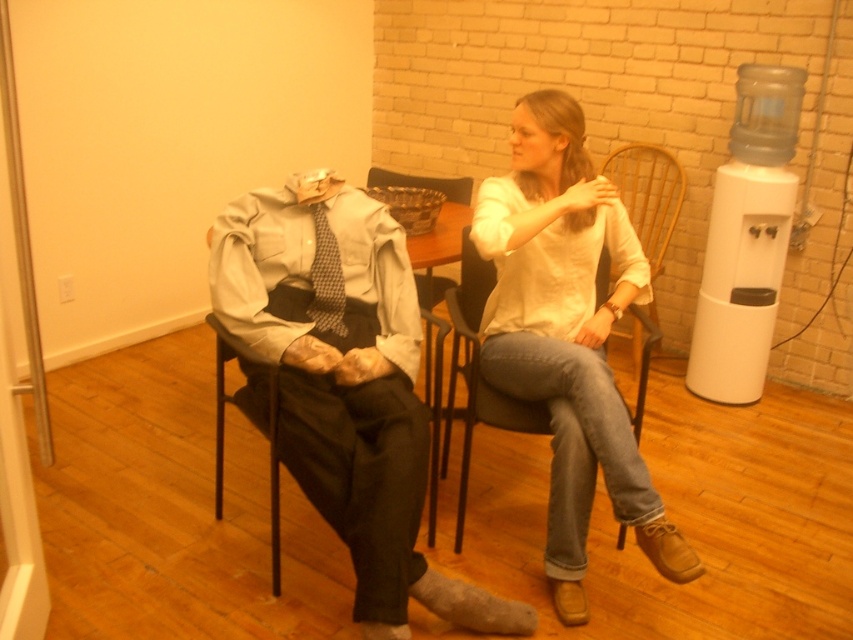
Who is positioned more to the right, matte gray suit at center or white cotton shirt at center?

white cotton shirt at center is more to the right.

Who is more distant from viewer, (282,454) or (532,388)?

The point (532,388) is more distant.

Does point (405, 273) come behind point (611, 442)?

Yes, it is behind point (611, 442).

You are a GUI agent. You are given a task and a screenshot of the screen. Output one action in this format:
    pyautogui.click(x=<x>, y=<y>)
    Task: Click on the matte gray suit at center
    
    Given the screenshot: What is the action you would take?
    pyautogui.click(x=344, y=390)

Is matte gray suit at center bigger than checkered fabric tie at center?

Indeed, matte gray suit at center has a larger size compared to checkered fabric tie at center.

Is point (347, 404) farther from camera compared to point (329, 310)?

No, it is in front of (329, 310).

Identify the location of matte gray suit at center. This screenshot has width=853, height=640. (344, 390).

Which is behind, point (548, 516) or point (471, 246)?

The point (471, 246) is more distant.

Is white cotton shirt at center shorter than black plastic chair at center?

No.

Is point (563, 179) positioned behind point (456, 547)?

No, (563, 179) is closer to viewer.

At what (x,y) coordinates should I click in order to perform the action: click on white cotton shirt at center. Please return your answer as a coordinate pair (x, y). This screenshot has height=640, width=853. Looking at the image, I should click on (567, 333).